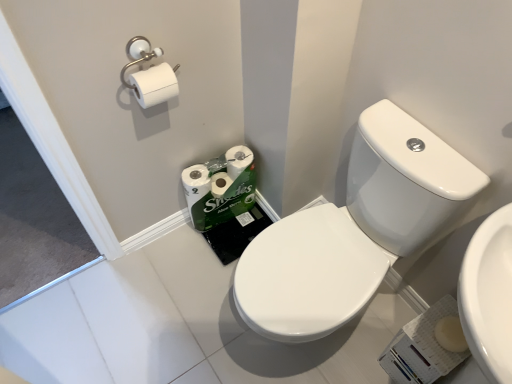
Question: From a real-world perspective, relative to green matte toilet paper at lower center, the second toilet paper in the front-to-back sequence, is white glossy sink at center right vertically above or below?

Choices:
 (A) above
 (B) below

Answer: (A)

Question: Is point (272, 317) positioned closer to the camera than point (212, 170)?

Choices:
 (A) farther
 (B) closer

Answer: (B)

Question: Estimate the real-world distances between objects in this image. Which object is farther from the white glossy sink at center right?

Choices:
 (A) white matte toilet paper at upper left, the first toilet paper from the top
 (B) green matte toilet paper at lower center, the 2th toilet paper positioned from the top

Answer: (A)

Question: Estimate the real-world distances between objects in this image. Which object is farther from the white matte toilet paper at upper left, arranged as the 2th toilet paper when ordered from the bottom?

Choices:
 (A) green matte toilet paper at lower center, the second toilet paper in the front-to-back sequence
 (B) white glossy sink at center right

Answer: (B)